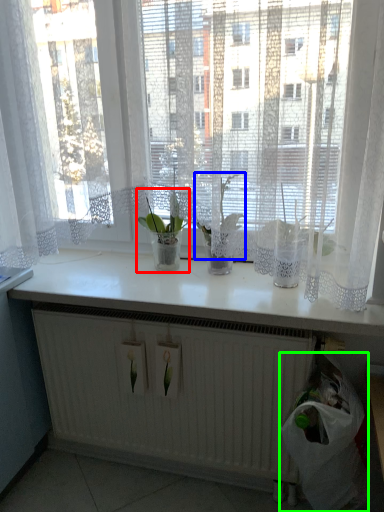
Question: Estimate the real-world distances between objects in this image. Which object is closer to houseplant (highlighted by a red box), orchid (highlighted by a blue box) or garbage (highlighted by a green box)?

Choices:
 (A) orchid
 (B) garbage

Answer: (A)